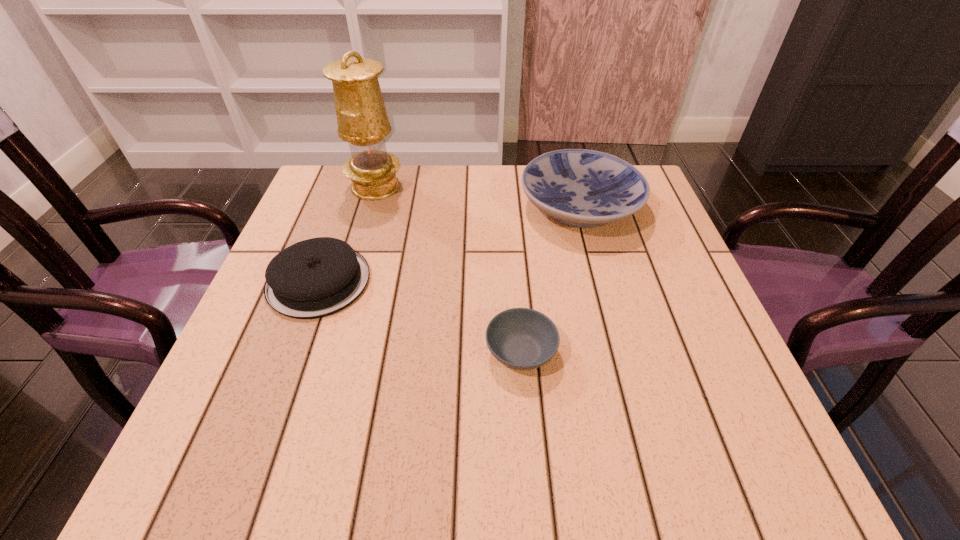
Identify the location of oil lamp. (362, 120).

Locate an element on the screen. the second tallest object is located at coordinates (583, 188).

The image size is (960, 540). In order to click on pancake in this screenshot , I will do `click(317, 277)`.

I want to click on the second shortest object, so click(x=317, y=277).

At what (x,y) coordinates should I click in order to perform the action: click on soup bowl. Please return your answer as a coordinate pair (x, y). This screenshot has width=960, height=540. Looking at the image, I should click on (520, 338).

Where is `the shortest object`? the shortest object is located at coordinates (520, 338).

Locate an element on the screen. The width and height of the screenshot is (960, 540). free point located 0.210m on the right of the oil lamp is located at coordinates (483, 187).

The height and width of the screenshot is (540, 960). Identify the location of vacant space located 0.400m on the front of the third shortest object. (635, 410).

Where is `free region located on the back of the second nearest object`? free region located on the back of the second nearest object is located at coordinates (361, 166).

This screenshot has width=960, height=540. I want to click on free space located on the right of the shortest object, so click(718, 352).